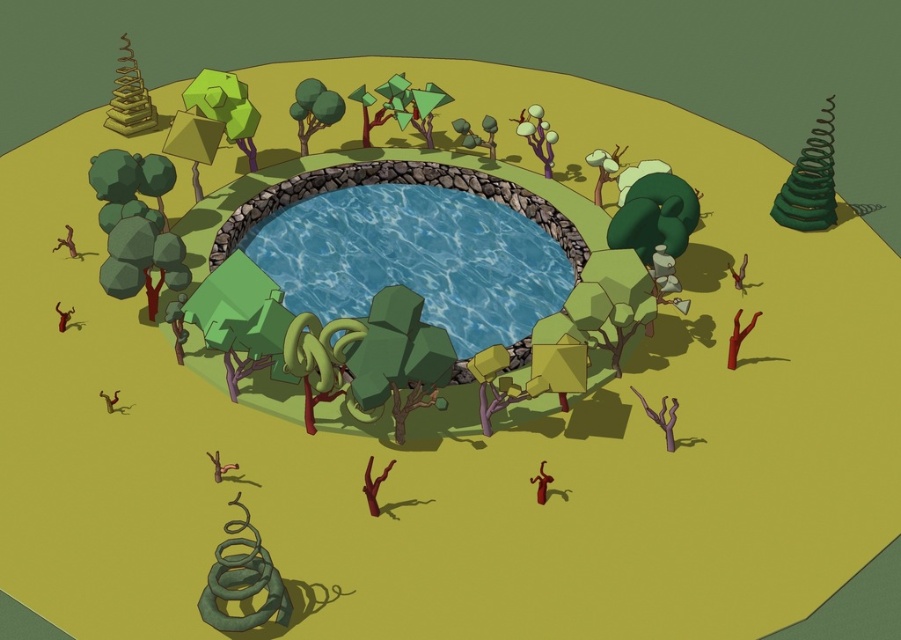
The width and height of the screenshot is (901, 640). Describe the element at coordinates (135, 225) in the screenshot. I see `dark green matte tree at left` at that location.

Which of these two, dark green matte tree at left or green matte spiral at upper right, stands taller?

green matte spiral at upper right

Identify the location of dark green matte tree at left. The image size is (901, 640). (135, 225).

Where is `dark green matte tree at left`? This screenshot has height=640, width=901. dark green matte tree at left is located at coordinates (135, 225).

Between green matte spiral at upper right and green matte tree at upper center, which one appears on the left side from the viewer's perspective?

From the viewer's perspective, green matte tree at upper center appears more on the left side.

Measure the distance from green matte spiral at upper right to green matte tree at upper center.

A distance of 27.52 inches exists between green matte spiral at upper right and green matte tree at upper center.

I want to click on green matte spiral at upper right, so click(x=810, y=180).

Looking at this image, does blue glossy pond at center come in front of dark green matte tree at left?

Yes, it is.

Can you confirm if blue glossy pond at center is bigger than dark green matte tree at left?

Yes.

Identify the location of blue glossy pond at center. (414, 252).